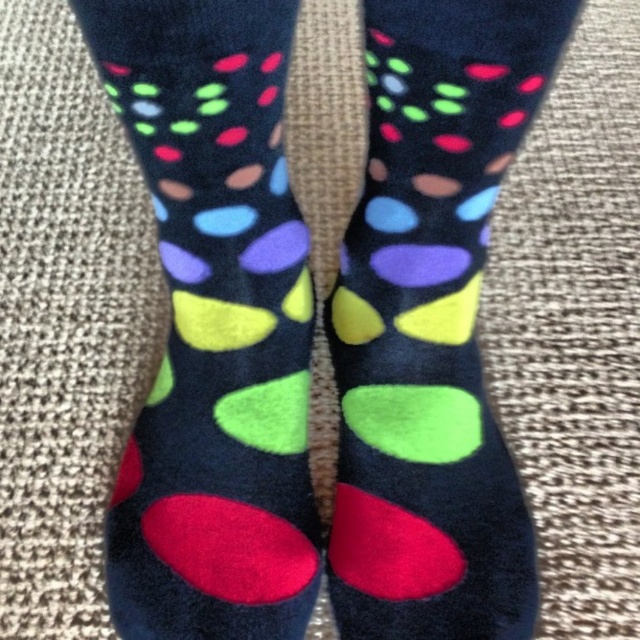
Question: Which point is closer to the camera?

Choices:
 (A) fuzzy multicolored socks at center
 (B) matte black socks at center

Answer: (A)

Question: Does fuzzy multicolored socks at center have a larger size compared to matte black socks at center?

Choices:
 (A) yes
 (B) no

Answer: (A)

Question: Can you confirm if fuzzy multicolored socks at center is positioned to the left of matte black socks at center?

Choices:
 (A) yes
 (B) no

Answer: (A)

Question: Does fuzzy multicolored socks at center lie behind matte black socks at center?

Choices:
 (A) no
 (B) yes

Answer: (A)